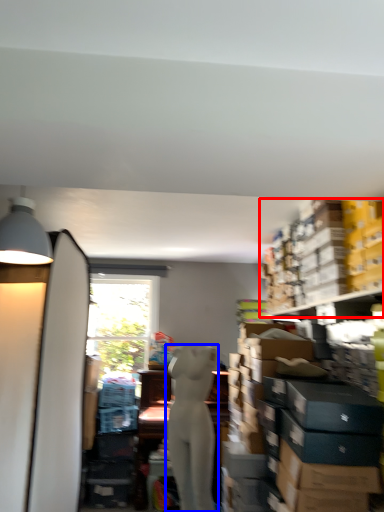
Question: Which object appears farthest to the camera in this image, shelf (highlighted by a red box) or person (highlighted by a blue box)?

Choices:
 (A) shelf
 (B) person

Answer: (B)